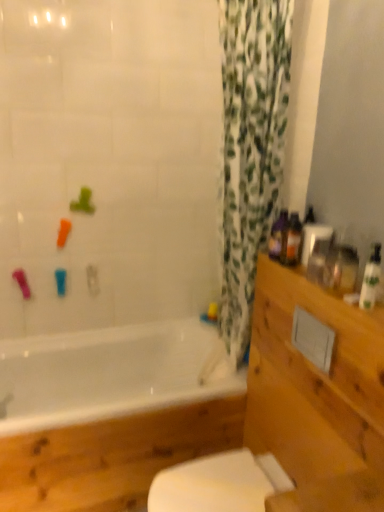
Question: Would you say white glossy bathtub at lower left is outside translucent plastic bottle at right, which is the 3th toiletry from right to left?

Choices:
 (A) yes
 (B) no

Answer: (A)

Question: Can you confirm if white glossy bathtub at lower left is bigger than translucent plastic bottle at right, which is the 1th toiletry in left-to-right order?

Choices:
 (A) yes
 (B) no

Answer: (A)

Question: From the image's perspective, is white glossy bathtub at lower left located beneath translucent plastic bottle at right, which appears as the 3th toiletry when viewed from the front?

Choices:
 (A) yes
 (B) no

Answer: (A)

Question: Can you confirm if white glossy bathtub at lower left is wider than translucent plastic bottle at right, placed as the 1th toiletry when sorted from back to front?

Choices:
 (A) yes
 (B) no

Answer: (A)

Question: Is white glossy bathtub at lower left shorter than translucent plastic bottle at right, placed as the 1th toiletry when sorted from back to front?

Choices:
 (A) no
 (B) yes

Answer: (A)

Question: Based on their positions, is wooden drawer at right located to the left or right of white glossy bottle at right, the third toiletry in the left-to-right sequence?

Choices:
 (A) right
 (B) left

Answer: (B)

Question: From the image's perspective, relative to white glossy bottle at right, the 3th toiletry viewed from the back, is wooden drawer at right above or below?

Choices:
 (A) above
 (B) below

Answer: (B)

Question: From a real-world perspective, is wooden drawer at right physically located above or below white glossy bottle at right, the third toiletry in the left-to-right sequence?

Choices:
 (A) above
 (B) below

Answer: (B)

Question: Is point (292, 380) closer or farther from the camera than point (374, 261)?

Choices:
 (A) closer
 (B) farther

Answer: (B)

Question: Considering the relative positions of wooden drawer at right and translucent plastic bottle at right, which is the 3th toiletry from right to left, in the image provided, is wooden drawer at right to the left or to the right of translucent plastic bottle at right, which is the 3th toiletry from right to left,?

Choices:
 (A) left
 (B) right

Answer: (B)

Question: Does point (306, 412) appear closer or farther from the camera than point (279, 251)?

Choices:
 (A) farther
 (B) closer

Answer: (B)

Question: From the image's perspective, is wooden drawer at right above or below translucent plastic bottle at right, which is the 3th toiletry from right to left?

Choices:
 (A) below
 (B) above

Answer: (A)

Question: Considering the positions of wooden drawer at right and translucent plastic bottle at right, which is the 3th toiletry from right to left, in the image, is wooden drawer at right wider or thinner than translucent plastic bottle at right, which is the 3th toiletry from right to left,?

Choices:
 (A) wide
 (B) thin

Answer: (A)

Question: From the image's perspective, is green leafy fabric at center above or below white glossy bathtub at lower left?

Choices:
 (A) below
 (B) above

Answer: (B)

Question: Considering their positions, is green leafy fabric at center located in front of or behind white glossy bathtub at lower left?

Choices:
 (A) front
 (B) behind

Answer: (A)